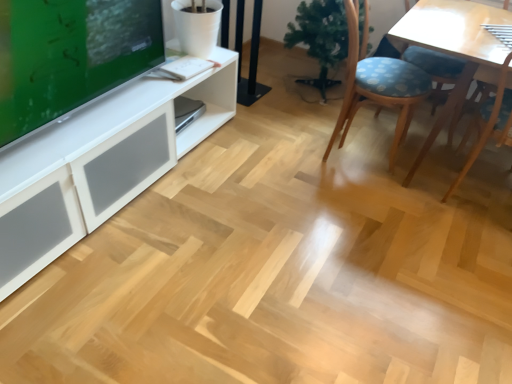
You are a GUI agent. You are given a task and a screenshot of the screen. Output one action in this format:
    pyautogui.click(x=<x>, y=<y>)
    Task: Click on the free space in front of blue fabric chair at center-right
    This screenshot has width=512, height=384.
    Given the screenshot: What is the action you would take?
    pyautogui.click(x=362, y=197)